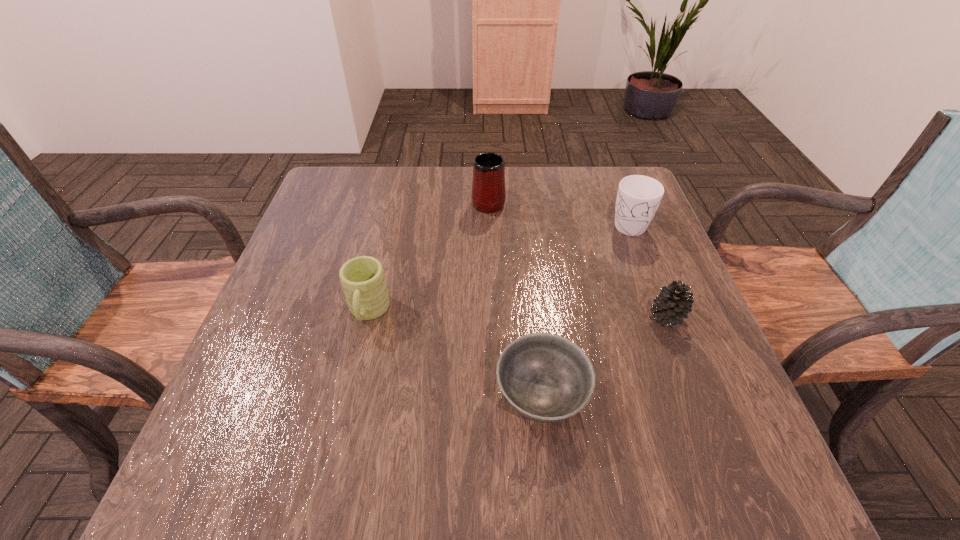
This screenshot has width=960, height=540. I want to click on vacant area in the image that satisfies the following two spatial constraints: 1. on the side of the nearest object with the handle; 2. on the left side of the leftmost mug, so click(x=348, y=396).